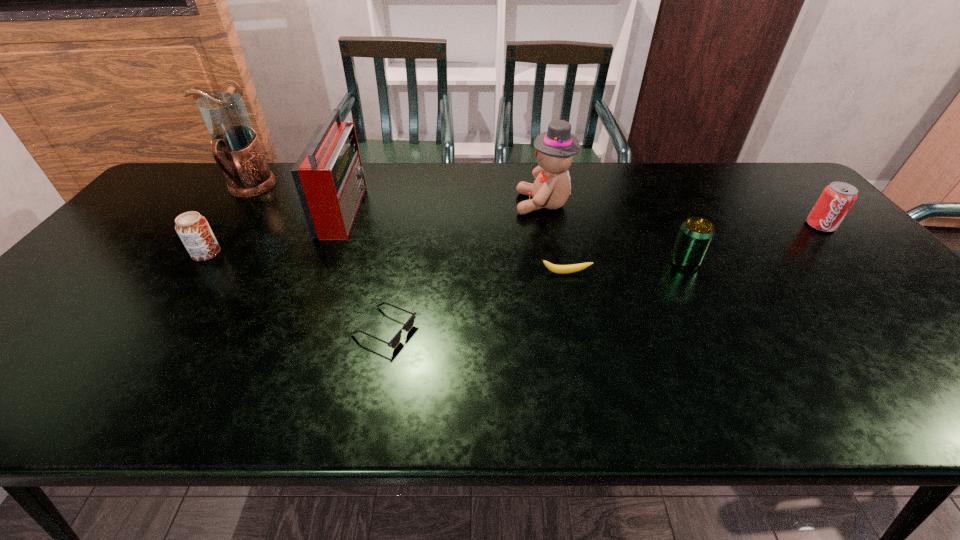
Locate an element on the screen. The height and width of the screenshot is (540, 960). radio receiver situated at the far edge is located at coordinates (328, 175).

Locate an element on the screen. rag_doll that is positioned at the far edge is located at coordinates (555, 148).

Find the location of `object that is at the right edge`. object that is at the right edge is located at coordinates (837, 198).

Identify the location of vacant area at the far edge of the desktop. Image resolution: width=960 pixels, height=540 pixels. (668, 184).

Where is `vacant area at the near edge`? This screenshot has width=960, height=540. vacant area at the near edge is located at coordinates tap(667, 380).

The width and height of the screenshot is (960, 540). I want to click on vacant space at the left edge of the desktop, so click(98, 265).

Where is `vacant space at the right edge`? Image resolution: width=960 pixels, height=540 pixels. vacant space at the right edge is located at coordinates (796, 207).

At what (x,y) coordinates should I click in order to perform the action: click on free point between the left beer can and the radio receiver. Please return your answer as a coordinate pair (x, y). The width and height of the screenshot is (960, 540). Looking at the image, I should click on (275, 232).

Locate an element on the screen. The width and height of the screenshot is (960, 540). vacant area that lies between the second object from right to left and the left beer can is located at coordinates (445, 258).

You are a GUI agent. You are given a task and a screenshot of the screen. Output one action in this format:
    pyautogui.click(x=<x>, y=<y>)
    Task: Click on the empty location between the left beer can and the banana
    
    Given the screenshot: What is the action you would take?
    pyautogui.click(x=386, y=264)